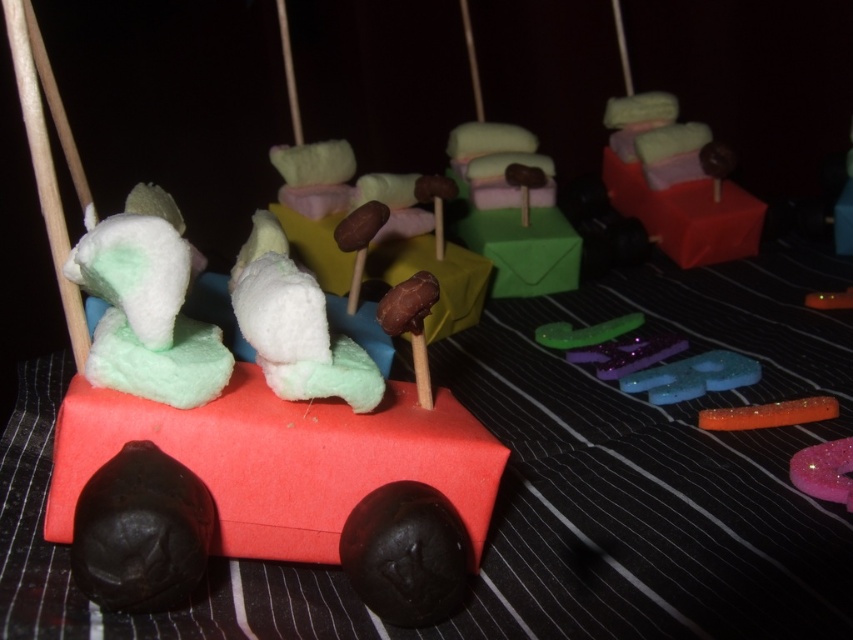
You are a photographer standing at a certain distance from the white marshmallow at center. If you want to take a closeup photo of it without moving the camera, what adjustment should you make to your camera lens?

You should zoom in on the white marshmallow at center because it is 3.30 feet away from the camera, which may be too far for a closeup without zoom.

You are at a festive event and see the translucent blue glittery star at center and the glittery pink letter at lower right. Which object is positioned to the right side of the scene?

The glittery pink letter at lower right is positioned to the right side of the scene.

You are a guest at a party where these edible vehicles are displayed. You want to place a small decoration on top of the tallest object between the white marshmallow at center and the matte pink candy at upper right. Which object should you choose?

The matte pink candy at upper right is taller than the white marshmallow at center, so you should place the decoration on top of the matte pink candy at upper right.